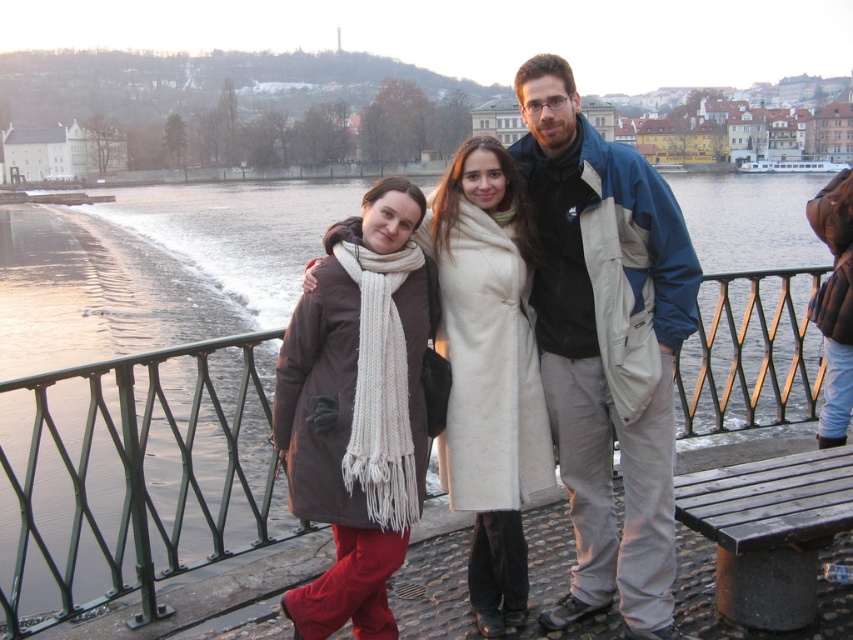
Question: Can you confirm if white woolen coat at center is thinner than white wool scarf at center?

Choices:
 (A) no
 (B) yes

Answer: (B)

Question: Which point is closer to the camera?

Choices:
 (A) matte white coat at center
 (B) green metal railing at center
 (C) white woolen coat at center
 (D) white knitted scarf at center

Answer: (A)

Question: Is green metal railing at center wider than white woolen coat at center?

Choices:
 (A) no
 (B) yes

Answer: (B)

Question: Does white woolen coat at center have a smaller size compared to wooden bench at lower right?

Choices:
 (A) yes
 (B) no

Answer: (B)

Question: Which object is the farthest from the blue/white jacket at center?

Choices:
 (A) white wool scarf at center
 (B) green metal railing at center

Answer: (B)

Question: Estimate the real-world distances between objects in this image. Which object is closer to the green metal railing at center?

Choices:
 (A) wooden bench at lower right
 (B) white knitted scarf at center
 (C) matte white coat at center

Answer: (B)